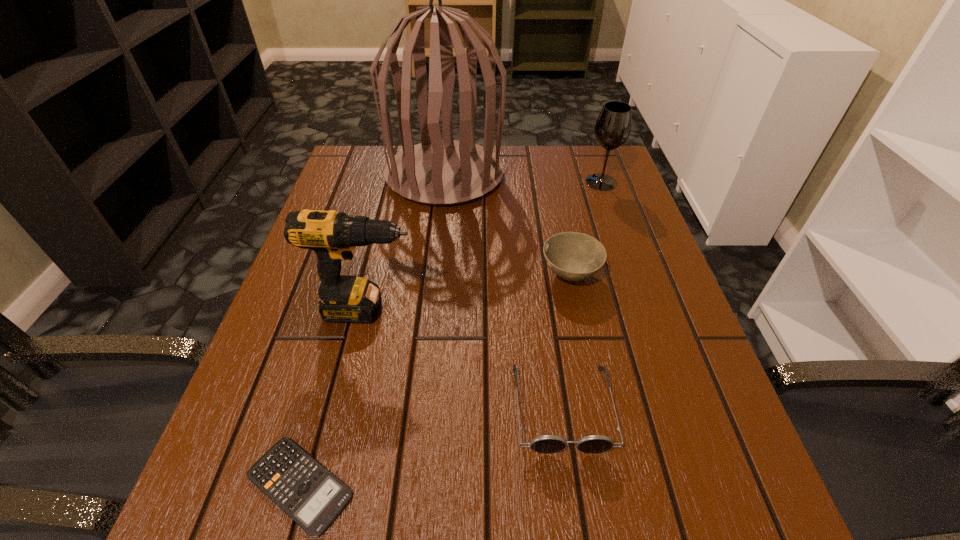
Identify the location of free space between the calculator and the tallest object. (372, 330).

Find the location of a particular element. The height and width of the screenshot is (540, 960). free point between the calculator and the drill is located at coordinates (334, 397).

Where is `unoccupied area between the birdcage and the rightmost object`? The image size is (960, 540). unoccupied area between the birdcage and the rightmost object is located at coordinates (523, 179).

Find the location of a particular element. free space between the second shortest object and the drill is located at coordinates (466, 359).

Image resolution: width=960 pixels, height=540 pixels. Identify the location of free space between the third shortest object and the drill. (469, 292).

You are a GUI agent. You are given a task and a screenshot of the screen. Output one action in this format:
    pyautogui.click(x=<x>, y=<y>)
    Task: Click on the free space between the shortest object and the drill
    
    Given the screenshot: What is the action you would take?
    pyautogui.click(x=334, y=397)

Identify the location of empty space that is in between the tallest object and the fifth tallest object. This screenshot has width=960, height=540. (503, 291).

Identify which object is located as the second nearest to the shortest object. Please provide its 2D coordinates. Your answer should be formatted as a tuple, i.e. [(x, y)], where the tuple contains the x and y coordinates of a point satisfying the conditions above.

[(546, 444)]

Where is `object that ranks as the second closest to the birdcage`? This screenshot has height=540, width=960. object that ranks as the second closest to the birdcage is located at coordinates (613, 127).